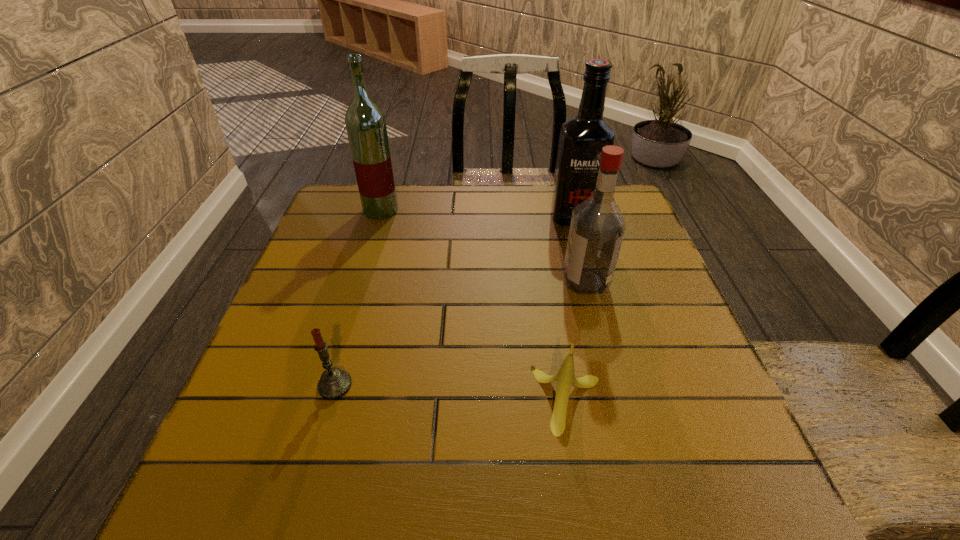
In the image, there is a desktop. Where is `free space at the far right corner`? Image resolution: width=960 pixels, height=540 pixels. free space at the far right corner is located at coordinates (629, 198).

What are the coordinates of `vacant region at the near right corner of the desktop` in the screenshot? It's located at (732, 514).

You are a GUI agent. You are given a task and a screenshot of the screen. Output one action in this format:
    pyautogui.click(x=<x>, y=<y>)
    Task: Click on the unoccupied area between the leftmost liquor and the banana
    The height and width of the screenshot is (540, 960).
    Given the screenshot: What is the action you would take?
    pyautogui.click(x=474, y=305)

In order to click on free spot between the nearest liquor and the fourth tallest object in this screenshot , I will do `click(461, 333)`.

This screenshot has height=540, width=960. Find the location of `blank region between the nearest liquor and the shortest object`. blank region between the nearest liquor and the shortest object is located at coordinates (577, 340).

Identify the location of vacant area that lies between the shortest liquor and the candle. (461, 333).

Identify the location of vacant region between the shortest object and the candle. (451, 393).

Find the location of `free space between the shortest object and the leftmost liquor`. free space between the shortest object and the leftmost liquor is located at coordinates (474, 305).

Locate an element on the screen. free space between the shortest liquor and the second shortest object is located at coordinates (461, 333).

At what (x,y) coordinates should I click in order to perform the action: click on vacant area between the leftmost liquor and the banana. Please return your answer as a coordinate pair (x, y). Looking at the image, I should click on (474, 305).